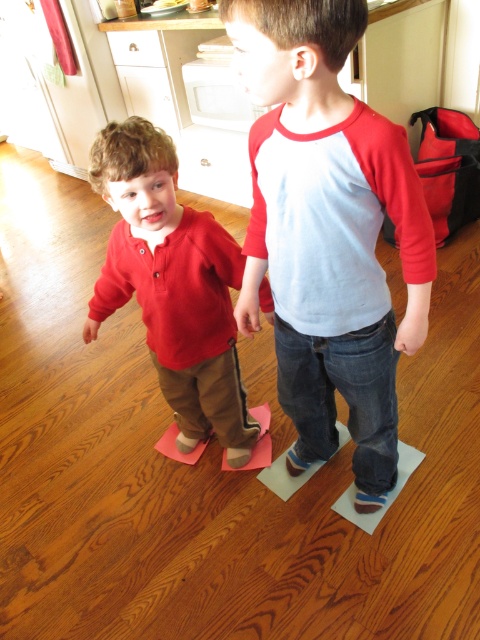
Question: In this image, where is matte red shirt at center located relative to matte red sweater at left?

Choices:
 (A) below
 (B) above

Answer: (B)

Question: Which object appears farthest from the camera in this image?

Choices:
 (A) matte red sweater at left
 (B) matte red shirt at center

Answer: (A)

Question: Is matte red shirt at center thinner than matte red sweater at left?

Choices:
 (A) yes
 (B) no

Answer: (A)

Question: Can you confirm if matte red shirt at center is thinner than matte red sweater at left?

Choices:
 (A) no
 (B) yes

Answer: (B)